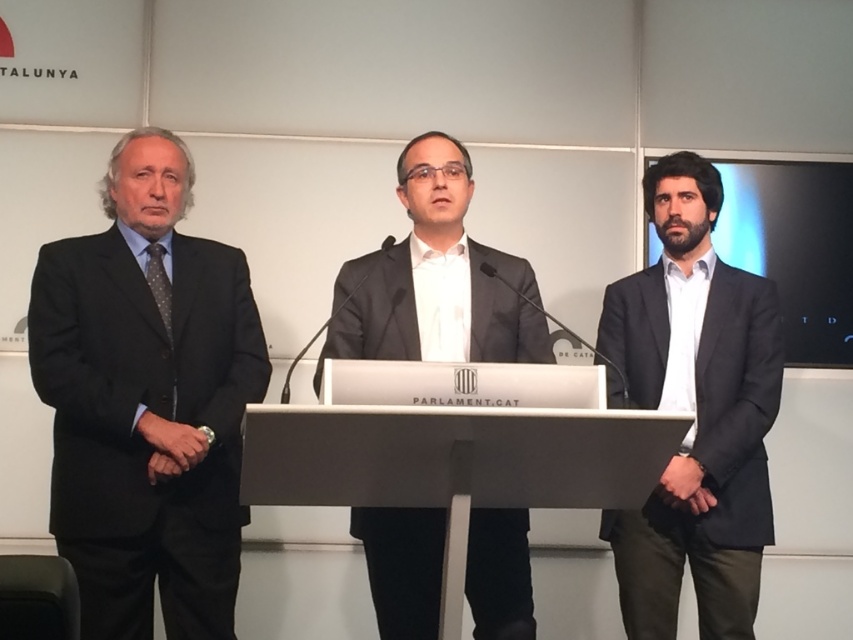
Is matte gray suit at center positioned before white plastic podium at center?

No, matte gray suit at center is further to the viewer.

Between matte gray suit at center and white plastic podium at center, which one is positioned higher?

matte gray suit at center is above.

The height and width of the screenshot is (640, 853). In order to click on matte gray suit at center in this screenshot , I will do `click(436, 280)`.

Locate an element on the screen. matte gray suit at center is located at coordinates (436, 280).

Where is `matte black suit at left`? This screenshot has height=640, width=853. matte black suit at left is located at coordinates (148, 401).

Can you confirm if matte black suit at left is taller than matte gray suit at center?

Yes, matte black suit at left is taller than matte gray suit at center.

Is point (90, 256) positioned before point (431, 522)?

No, (90, 256) is behind (431, 522).

You are a GUI agent. You are given a task and a screenshot of the screen. Output one action in this format:
    pyautogui.click(x=<x>, y=<y>)
    Task: Click on the matte black suit at left
    The height and width of the screenshot is (640, 853).
    Given the screenshot: What is the action you would take?
    pyautogui.click(x=148, y=401)

From the picture: Is matte black suit at left bigger than white plastic podium at center?

Yes, matte black suit at left is bigger than white plastic podium at center.

Which is below, matte black suit at left or white plastic podium at center?

Positioned lower is white plastic podium at center.

Identify the location of matte black suit at left. (148, 401).

The image size is (853, 640). Find the location of `matte black suit at left`. matte black suit at left is located at coordinates (148, 401).